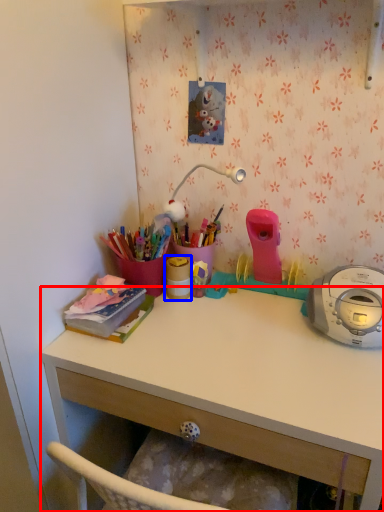
Question: Which object is closer to the camera taking this photo, desk (highlighted by a red box) or office supplies (highlighted by a blue box)?

Choices:
 (A) desk
 (B) office supplies

Answer: (A)